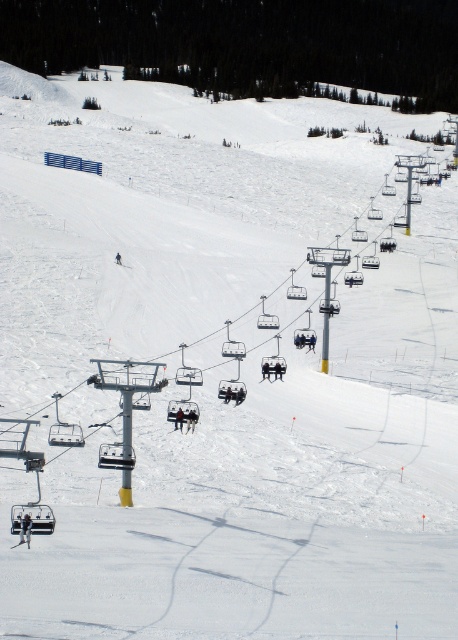
You are a photographer standing on the slope and want to capture both the matte black ski at lower left and the black fabric skier at center in a single shot. Based on their positions, which object should appear closer to the bottom of the photo?

The matte black ski at lower left is positioned below the black fabric skier at center, so it will appear closer to the bottom of the photo.

You are a photographer trying to capture a wide shot of the ski resort scene. You notice a metallic ski lift seat at center and a matte black ski at lower left. Given their widths, which object would require you to zoom out more to fully capture it in your photo?

The metallic ski lift seat at center might be wider than matte black ski at lower left, so you would need to zoom out more to fully capture the metallic ski lift seat at center in your photo.

You are a safety inspector at the ski resort and need to ensure that the distance between the matte black ski at lower left and the black fabric skier at center is within the safety regulation of 100 meters. Can you confirm if this distance meets the requirement?

The matte black ski at lower left is 89.94 meters from the black fabric skier at center, which is within the 100 meters safety regulation requirement.